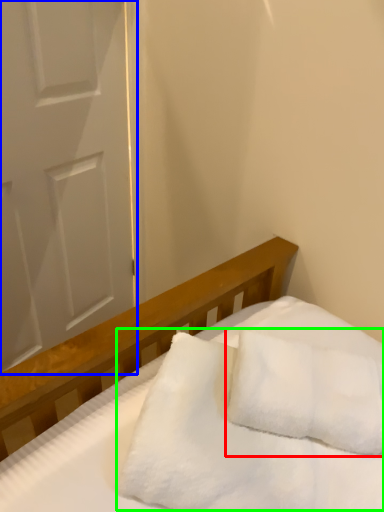
Question: Which object is the closest to the pillow (highlighted by a red box)? Choose among these: door (highlighted by a blue box) or blanket (highlighted by a green box).

Choices:
 (A) door
 (B) blanket

Answer: (B)